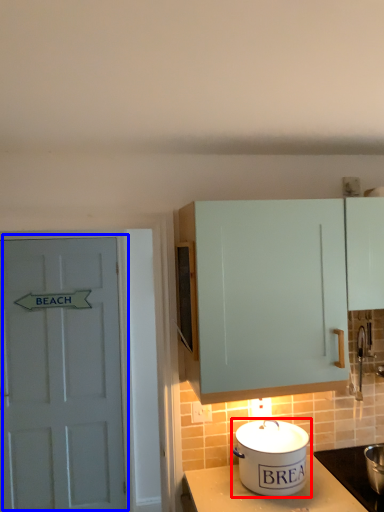
Question: Which point is further to the camera, kitchen appliance (highlighted by a red box) or door (highlighted by a blue box)?

Choices:
 (A) kitchen appliance
 (B) door

Answer: (B)